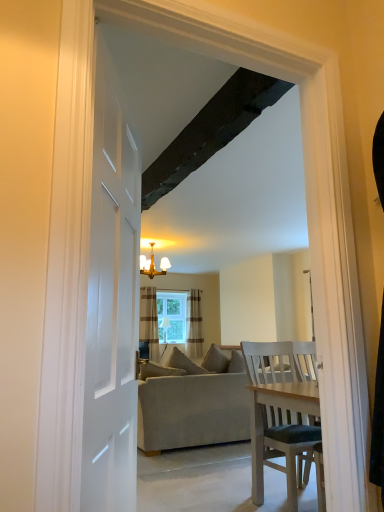
Question: From a real-world perspective, is beige fabric couch at center under brown striped curtain at center, acting as the second curtain starting from the right?

Choices:
 (A) no
 (B) yes

Answer: (B)

Question: Is beige fabric couch at center facing towards brown striped curtain at center, the first curtain from the left?

Choices:
 (A) no
 (B) yes

Answer: (B)

Question: Does beige fabric couch at center come in front of brown striped curtain at center, acting as the second curtain starting from the right?

Choices:
 (A) yes
 (B) no

Answer: (A)

Question: Is brown striped curtain at center, acting as the second curtain starting from the right, at the back of beige fabric couch at center?

Choices:
 (A) yes
 (B) no

Answer: (B)

Question: Is beige fabric couch at center positioned far away from brown striped curtain at center, the first curtain from the left?

Choices:
 (A) yes
 (B) no

Answer: (A)

Question: Is dark wood beam at upper center situated inside clear glass window at center or outside?

Choices:
 (A) outside
 (B) inside

Answer: (A)

Question: From the image's perspective, relative to clear glass window at center, is dark wood beam at upper center above or below?

Choices:
 (A) below
 (B) above

Answer: (B)

Question: Considering their positions, is dark wood beam at upper center located in front of or behind clear glass window at center?

Choices:
 (A) front
 (B) behind

Answer: (A)

Question: Based on their sizes in the image, would you say dark wood beam at upper center is bigger or smaller than clear glass window at center?

Choices:
 (A) small
 (B) big

Answer: (A)

Question: In terms of width, does brown striped curtain at center, the first curtain from the left, look wider or thinner when compared to striped fabric curtain at center, which ranks as the 1th curtain in right-to-left order?

Choices:
 (A) thin
 (B) wide

Answer: (B)

Question: Is brown striped curtain at center, the first curtain from the left, spatially inside striped fabric curtain at center, which ranks as the 1th curtain in right-to-left order, or outside of it?

Choices:
 (A) inside
 (B) outside

Answer: (B)

Question: From a real-world perspective, is brown striped curtain at center, acting as the second curtain starting from the right, above or below striped fabric curtain at center, which ranks as the 2th curtain in left-to-right order?

Choices:
 (A) below
 (B) above

Answer: (B)

Question: In terms of size, does brown striped curtain at center, the first curtain from the left, appear bigger or smaller than striped fabric curtain at center, which ranks as the 1th curtain in right-to-left order?

Choices:
 (A) small
 (B) big

Answer: (B)

Question: From the image's perspective, is clear glass window at center above or below gold metallic chandelier at upper center?

Choices:
 (A) above
 (B) below

Answer: (B)

Question: Considering their positions, is clear glass window at center located in front of or behind gold metallic chandelier at upper center?

Choices:
 (A) front
 (B) behind

Answer: (B)